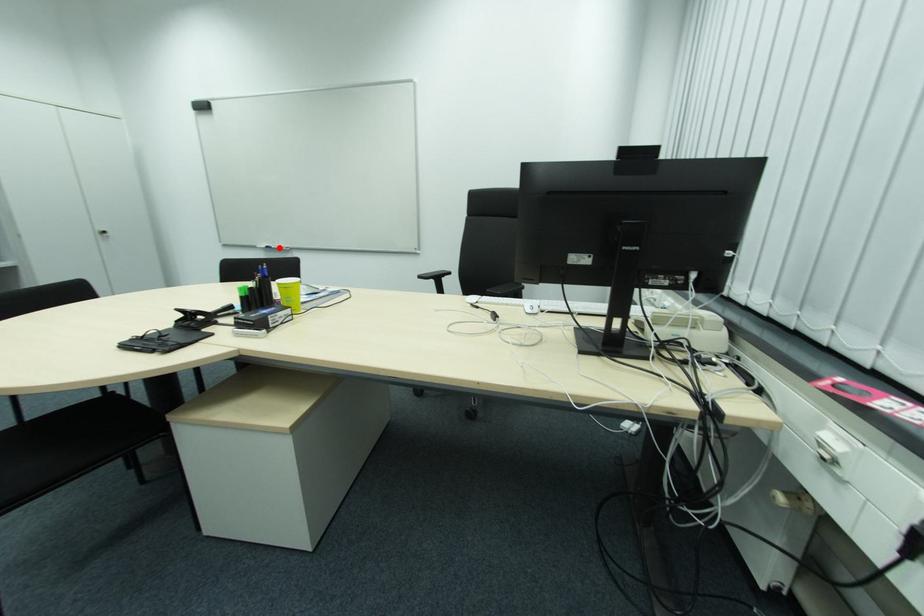
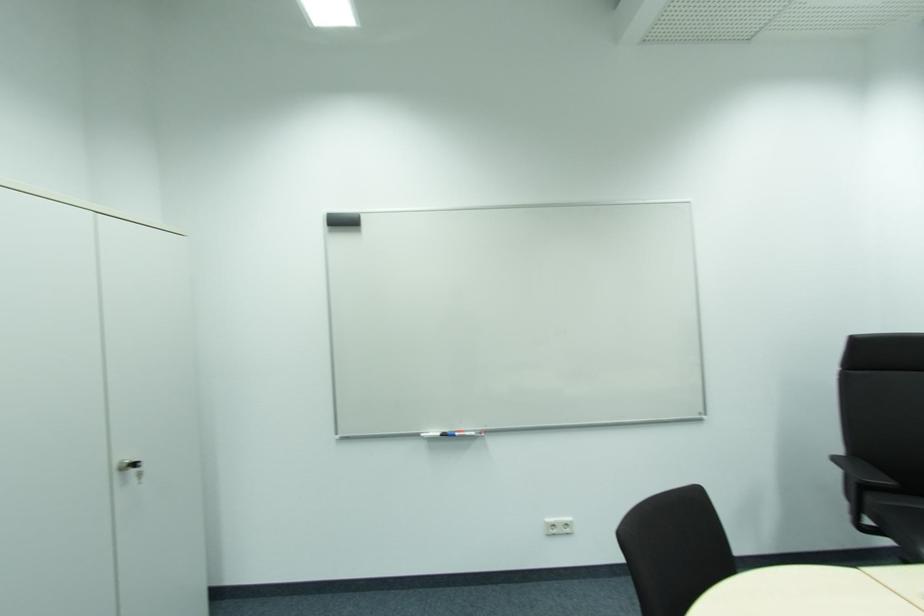
Where in the second image is the point corresponding to the highlighted location from the first image?

(464, 434)